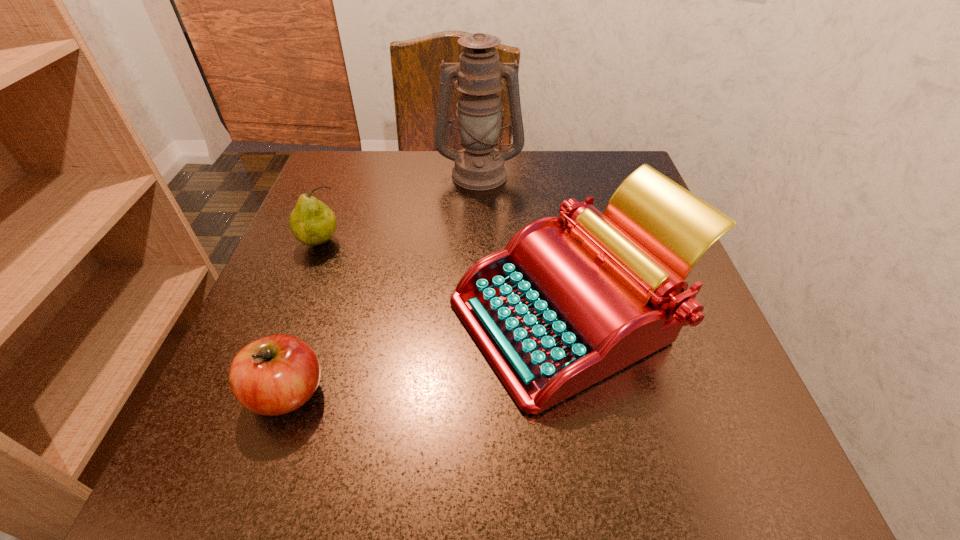
Image resolution: width=960 pixels, height=540 pixels. Identify the location of oil lamp. (479, 166).

Identify the location of the tallest object. This screenshot has height=540, width=960. (479, 166).

At what (x,y) coordinates should I click in order to perform the action: click on the third shortest object. Please return your answer as a coordinate pair (x, y). This screenshot has height=540, width=960. Looking at the image, I should click on (558, 310).

Where is `pear`? pear is located at coordinates (312, 223).

Where is `apple`? apple is located at coordinates (275, 375).

What are the coordinates of `free region located on the front of the tallest object` in the screenshot? It's located at (479, 265).

The width and height of the screenshot is (960, 540). Find the location of `free spot located on the typing side of the typewriter`. free spot located on the typing side of the typewriter is located at coordinates (420, 315).

Locate an element on the screen. Image resolution: width=960 pixels, height=540 pixels. vacant space located 0.150m on the typing side of the typewriter is located at coordinates (359, 315).

Where is `free space located on the typing side of the typewriter`? This screenshot has height=540, width=960. free space located on the typing side of the typewriter is located at coordinates (255, 315).

You are a GUI agent. You are given a task and a screenshot of the screen. Output one action in this format:
    pyautogui.click(x=<x>, y=<y>)
    Task: Click on the free spot located 0.300m on the front of the pear
    
    Given the screenshot: What is the action you would take?
    pyautogui.click(x=258, y=402)